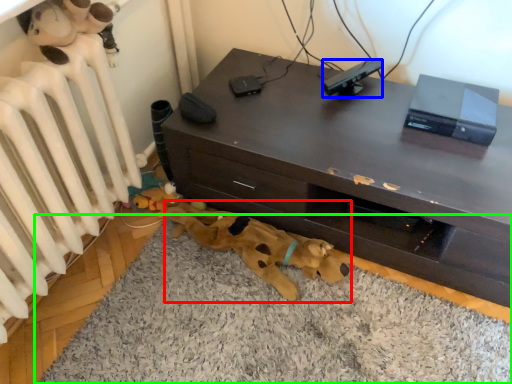
Question: Which is farther away from toy (highlighted by a red box)? equipment (highlighted by a blue box) or dog bed (highlighted by a green box)?

Choices:
 (A) equipment
 (B) dog bed

Answer: (A)